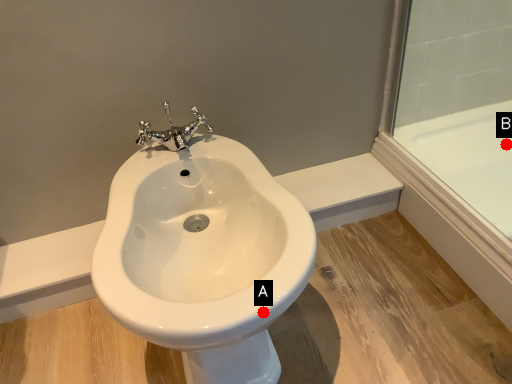
Question: Two points are circled on the image, labeled by A and B beside each circle. Which point appears closest to the camera in this image?

Choices:
 (A) A is closer
 (B) B is closer

Answer: (A)